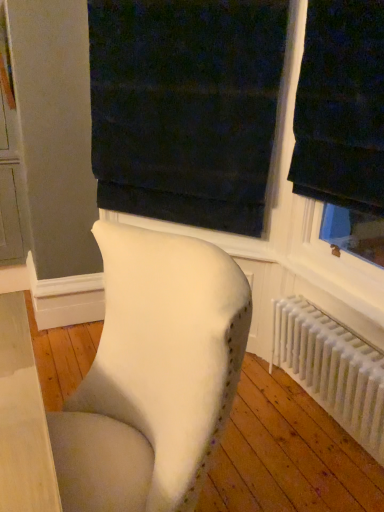
Question: From the image's perspective, is dark velvet curtain at upper center beneath white plastic radiator at lower right?

Choices:
 (A) yes
 (B) no

Answer: (B)

Question: From a real-world perspective, is dark velvet curtain at upper center physically below white plastic radiator at lower right?

Choices:
 (A) no
 (B) yes

Answer: (A)

Question: Is dark velvet curtain at upper center facing towards white plastic radiator at lower right?

Choices:
 (A) no
 (B) yes

Answer: (A)

Question: Is white plastic radiator at lower right a part of dark velvet curtain at upper center?

Choices:
 (A) no
 (B) yes

Answer: (A)

Question: Does dark velvet curtain at upper center have a greater height compared to white plastic radiator at lower right?

Choices:
 (A) no
 (B) yes

Answer: (B)

Question: Looking at the image, does dark velvet curtain at upper center seem bigger or smaller compared to white fabric chair at center?

Choices:
 (A) small
 (B) big

Answer: (A)

Question: From their relative heights in the image, would you say dark velvet curtain at upper center is taller or shorter than white fabric chair at center?

Choices:
 (A) tall
 (B) short

Answer: (A)

Question: Is dark velvet curtain at upper center inside the boundaries of white fabric chair at center, or outside?

Choices:
 (A) outside
 (B) inside

Answer: (A)

Question: From a real-world perspective, is dark velvet curtain at upper center above or below white fabric chair at center?

Choices:
 (A) below
 (B) above

Answer: (B)

Question: Is white fabric chair at center wider or thinner than dark velvet curtain at upper center?

Choices:
 (A) wide
 (B) thin

Answer: (A)

Question: Is white fabric chair at center inside or outside of dark velvet curtain at upper center?

Choices:
 (A) outside
 (B) inside

Answer: (A)

Question: From the image's perspective, is white fabric chair at center above or below dark velvet curtain at upper center?

Choices:
 (A) above
 (B) below

Answer: (B)

Question: Considering the positions of white fabric chair at center and dark velvet curtain at upper center in the image, is white fabric chair at center bigger or smaller than dark velvet curtain at upper center?

Choices:
 (A) small
 (B) big

Answer: (B)

Question: In the image, is white plastic radiator at lower right on the left side or the right side of dark velvet curtain at upper center?

Choices:
 (A) left
 (B) right

Answer: (B)

Question: Considering the positions of white plastic radiator at lower right and dark velvet curtain at upper center in the image, is white plastic radiator at lower right wider or thinner than dark velvet curtain at upper center?

Choices:
 (A) wide
 (B) thin

Answer: (A)